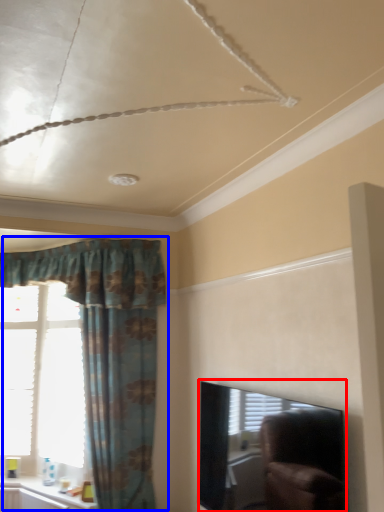
Question: Among these objects, which one is farthest to the camera, window screen (highlighted by a red box) or curtain (highlighted by a blue box)?

Choices:
 (A) window screen
 (B) curtain

Answer: (B)